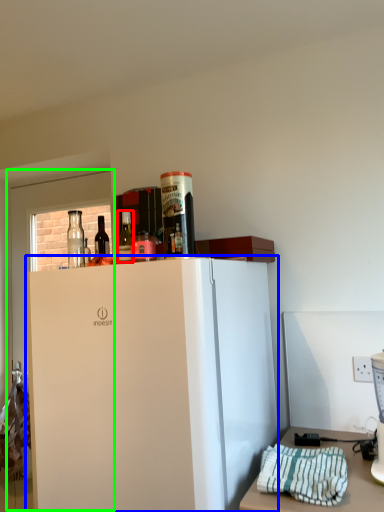
Question: Based on their relative distances, which object is farther from bottle (highlighted by a red box)? Choose from refrigerator (highlighted by a blue box) and glass door (highlighted by a green box).

Choices:
 (A) refrigerator
 (B) glass door

Answer: (B)